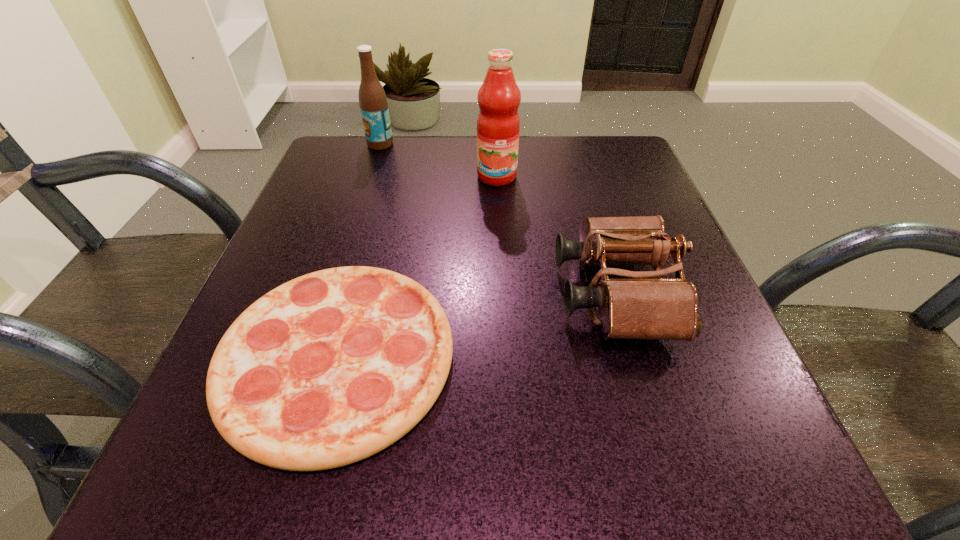
This screenshot has height=540, width=960. What are the coordinates of `empty space that is in between the binoculars and the second tallest object` in the screenshot? It's located at (497, 219).

I want to click on vacant space in between the rightmost object and the beer bottle, so click(x=497, y=219).

The height and width of the screenshot is (540, 960). Identify the location of vacant region between the farthest object and the second object from right to left. (439, 160).

Where is `free spot between the second shortest object and the second object from right to left`? The width and height of the screenshot is (960, 540). free spot between the second shortest object and the second object from right to left is located at coordinates (556, 235).

Where is `vacant region between the second object from right to left and the second tallest object`? Image resolution: width=960 pixels, height=540 pixels. vacant region between the second object from right to left and the second tallest object is located at coordinates (439, 160).

What are the coordinates of `free space between the pizza and the third shortest object` in the screenshot? It's located at (359, 251).

In order to click on free spot between the second tallest object and the third object from left to right in this screenshot , I will do [x=439, y=160].

Find the location of `unoccupied area between the fruit juice and the third tallest object`. unoccupied area between the fruit juice and the third tallest object is located at coordinates (556, 235).

Identify the location of object that is the closest to the pizza. (642, 307).

What are the coordinates of `object that is the second closest one to the third nearest object` in the screenshot? It's located at (373, 103).